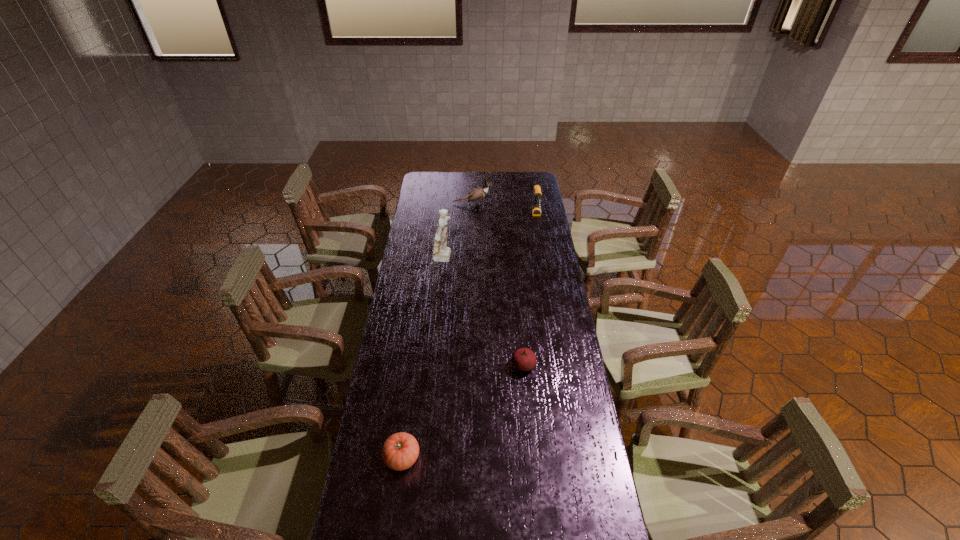
Select which object is the fourth closest to the left tomato. Please provide its 2D coordinates. Your answer should be formatted as a tuple, i.e. [(x, y)], where the tuple contains the x and y coordinates of a point satisfying the conditions above.

[(479, 193)]

Identify the location of object that ranks as the third closest to the bird. (523, 359).

You are a GUI agent. You are given a task and a screenshot of the screen. Output one action in this format:
    pyautogui.click(x=<x>, y=<y>)
    Task: Click on the free space in the image that satisfies the following two spatial constraints: 1. on the front-facing side of the right tomato; 2. on the left side of the third farthest object
    
    Given the screenshot: What is the action you would take?
    pyautogui.click(x=435, y=366)

Identify the location of vacant space that satisfies the following two spatial constraints: 1. on the front-facing side of the tallest object; 2. on the front side of the left tomato. Image resolution: width=960 pixels, height=540 pixels. (426, 457).